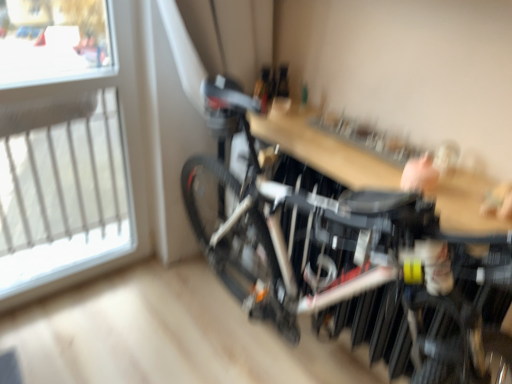
Question: Is wooden table at center thinner than transparent glass window at upper left?

Choices:
 (A) no
 (B) yes

Answer: (A)

Question: Can transparent glass window at upper left be found inside wooden table at center?

Choices:
 (A) yes
 (B) no

Answer: (B)

Question: From the image's perspective, is wooden table at center below transparent glass window at upper left?

Choices:
 (A) no
 (B) yes

Answer: (A)

Question: Is wooden table at center positioned with its back to transparent glass window at upper left?

Choices:
 (A) no
 (B) yes

Answer: (A)

Question: Can you confirm if wooden table at center is wider than transparent glass window at upper left?

Choices:
 (A) no
 (B) yes

Answer: (B)

Question: Based on their sizes in the image, would you say black matte bicycle at center is bigger or smaller than wooden table at center?

Choices:
 (A) big
 (B) small

Answer: (A)

Question: Considering the positions of point (212, 243) and point (453, 218), is point (212, 243) closer or farther from the camera than point (453, 218)?

Choices:
 (A) farther
 (B) closer

Answer: (A)

Question: From the image's perspective, is black matte bicycle at center located above or below wooden table at center?

Choices:
 (A) above
 (B) below

Answer: (B)

Question: In terms of height, does black matte bicycle at center look taller or shorter compared to wooden table at center?

Choices:
 (A) short
 (B) tall

Answer: (B)

Question: Is wooden table at center in front of or behind black matte bicycle at center in the image?

Choices:
 (A) behind
 (B) front

Answer: (A)

Question: From a real-world perspective, relative to black matte bicycle at center, is wooden table at center vertically above or below?

Choices:
 (A) above
 (B) below

Answer: (A)

Question: Is wooden table at center spatially inside black matte bicycle at center, or outside of it?

Choices:
 (A) inside
 (B) outside

Answer: (A)

Question: From the image's perspective, is wooden table at center located above or below black matte bicycle at center?

Choices:
 (A) below
 (B) above

Answer: (B)

Question: Based on their positions, is transparent glass window at upper left located to the left or right of wooden table at center?

Choices:
 (A) right
 (B) left

Answer: (B)

Question: In terms of width, does transparent glass window at upper left look wider or thinner when compared to wooden table at center?

Choices:
 (A) thin
 (B) wide

Answer: (A)